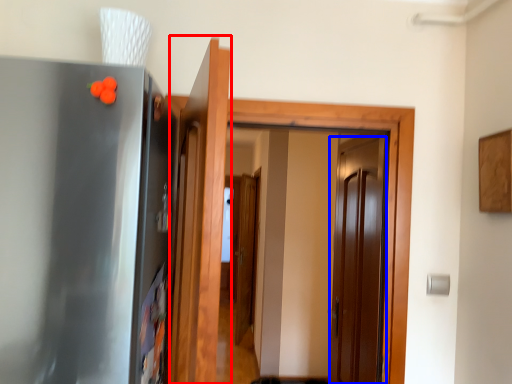
Question: Among these objects, which one is farthest to the camera, door (highlighted by a red box) or door (highlighted by a blue box)?

Choices:
 (A) door
 (B) door

Answer: (B)